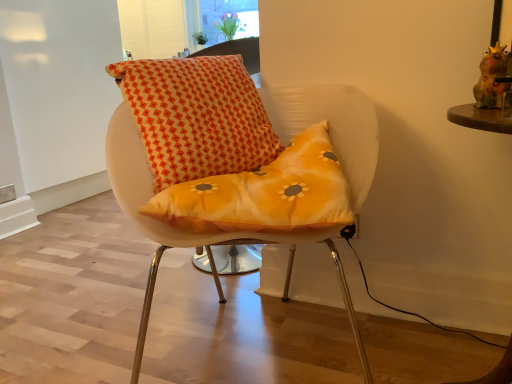
Describe the element at coordinates (482, 118) in the screenshot. This screenshot has width=512, height=384. I see `brown wooden table at right` at that location.

This screenshot has height=384, width=512. What do you see at coordinates (224, 149) in the screenshot?
I see `matte orange cushion at center` at bounding box center [224, 149].

Measure the distance between matte orange cushion at center and camera.

They are 35.93 inches apart.

I want to click on orange printed cushion at upper center, so click(196, 116).

At what (x,y) coordinates should I click in order to perform the action: click on window screen on the left of orange printed cushion at upper center. Please return your answer as a coordinate pair (x, y). This screenshot has height=384, width=512. Looking at the image, I should click on (228, 17).

Consider the image. From a real-world perspective, is orange printed cushion at upper center on transparent glass window at upper center?

No, from a real-world perspective, orange printed cushion at upper center is not above transparent glass window at upper center.

From the picture: Is orange printed cushion at upper center positioned before transparent glass window at upper center?

Yes, orange printed cushion at upper center is closer to the viewer.

Which is in front, transparent glass window at upper center or brown wooden table at right?

brown wooden table at right.

Is transparent glass window at upper center shorter than brown wooden table at right?

Yes, transparent glass window at upper center is shorter than brown wooden table at right.

Consider the image. Is transparent glass window at upper center next to brown wooden table at right and touching it?

transparent glass window at upper center is not next to brown wooden table at right, and they're not touching.

Which of these two, transparent glass window at upper center or brown wooden table at right, is wider?

brown wooden table at right is wider.

From a real-world perspective, is orange printed cushion at upper center positioned under matte orange cushion at center based on gravity?

No.

Who is shorter, orange printed cushion at upper center or matte orange cushion at center?

With less height is orange printed cushion at upper center.

Measure the distance from orange printed cushion at upper center to matte orange cushion at center.

2.35 inches.

Is transparent glass window at upper center surrounding orange printed cushion at upper center?

Definitely not — orange printed cushion at upper center is not inside transparent glass window at upper center.

Between transparent glass window at upper center and orange printed cushion at upper center, which one has larger size?

With larger size is transparent glass window at upper center.

From a real-world perspective, is transparent glass window at upper center beneath orange printed cushion at upper center?

No, from a real-world perspective, transparent glass window at upper center is not below orange printed cushion at upper center.

In the scene shown: Does transparent glass window at upper center come in front of orange printed cushion at upper center?

No, the depth of transparent glass window at upper center is greater than that of orange printed cushion at upper center.

Are matte orange cushion at center and transparent glass window at upper center far apart?

matte orange cushion at center is positioned a significant distance from transparent glass window at upper center.

From the image's perspective, is matte orange cushion at center located above transparent glass window at upper center?

No, from the image's perspective, matte orange cushion at center is not over transparent glass window at upper center.

Which of these two, matte orange cushion at center or transparent glass window at upper center, is wider?

With larger width is matte orange cushion at center.

Between matte orange cushion at center and transparent glass window at upper center, which one has more height?

Standing taller between the two is matte orange cushion at center.

Considering the sizes of objects brown wooden table at right and transparent glass window at upper center in the image provided, who is thinner, brown wooden table at right or transparent glass window at upper center?

transparent glass window at upper center.

From the image's perspective, is brown wooden table at right above or below transparent glass window at upper center?

From the image's perspective, brown wooden table at right appears below transparent glass window at upper center.

Does matte orange cushion at center have a greater height compared to brown wooden table at right?

Correct, matte orange cushion at center is much taller as brown wooden table at right.

Is matte orange cushion at center positioned with its back to brown wooden table at right?

No, matte orange cushion at center is not facing away from brown wooden table at right.

This screenshot has height=384, width=512. In order to click on chair above the brown wooden table at right (from the image's perspective) in this screenshot , I will do `click(224, 149)`.

Visually, is matte orange cushion at center positioned to the left or to the right of brown wooden table at right?

Clearly, matte orange cushion at center is on the left of brown wooden table at right in the image.

The width and height of the screenshot is (512, 384). In order to click on window screen on the left side of orange printed cushion at upper center in this screenshot , I will do `click(228, 17)`.

Image resolution: width=512 pixels, height=384 pixels. Find the location of `window screen above the brown wooden table at right (from a real-world perspective)`. window screen above the brown wooden table at right (from a real-world perspective) is located at coordinates (228, 17).

Based on their spatial positions, is matte orange cushion at center or transparent glass window at upper center further from brown wooden table at right?

Among the two, transparent glass window at upper center is located further to brown wooden table at right.

Which object lies nearer to the anchor point orange printed cushion at upper center, matte orange cushion at center or transparent glass window at upper center?

Based on the image, matte orange cushion at center appears to be nearer to orange printed cushion at upper center.

From the image, which object appears to be farther from brown wooden table at right, orange printed cushion at upper center or matte orange cushion at center?

orange printed cushion at upper center.

Based on their spatial positions, is matte orange cushion at center or brown wooden table at right closer to transparent glass window at upper center?

The object closer to transparent glass window at upper center is matte orange cushion at center.

Based on their spatial positions, is transparent glass window at upper center or brown wooden table at right closer to orange printed cushion at upper center?

Based on the image, brown wooden table at right appears to be nearer to orange printed cushion at upper center.

Based on their spatial positions, is brown wooden table at right or transparent glass window at upper center further from matte orange cushion at center?

Among the two, transparent glass window at upper center is located further to matte orange cushion at center.

Considering their positions, is orange printed cushion at upper center positioned closer to matte orange cushion at center than transparent glass window at upper center?

Among the two, orange printed cushion at upper center is located nearer to matte orange cushion at center.

Estimate the real-world distances between objects in this image. Which object is closer to transparent glass window at upper center, brown wooden table at right or orange printed cushion at upper center?

The object closer to transparent glass window at upper center is orange printed cushion at upper center.

Image resolution: width=512 pixels, height=384 pixels. Identify the location of chair between orange printed cushion at upper center and brown wooden table at right from left to right. (224, 149).

Identify the location of chair between brown wooden table at right and transparent glass window at upper center along the z-axis. The image size is (512, 384). (224, 149).

Image resolution: width=512 pixels, height=384 pixels. What are the coordinates of `pillow between matte orange cushion at center and transparent glass window at upper center in the front-back direction` in the screenshot? It's located at (196, 116).

Identify the location of pillow between brown wooden table at right and transparent glass window at upper center from front to back. (196, 116).